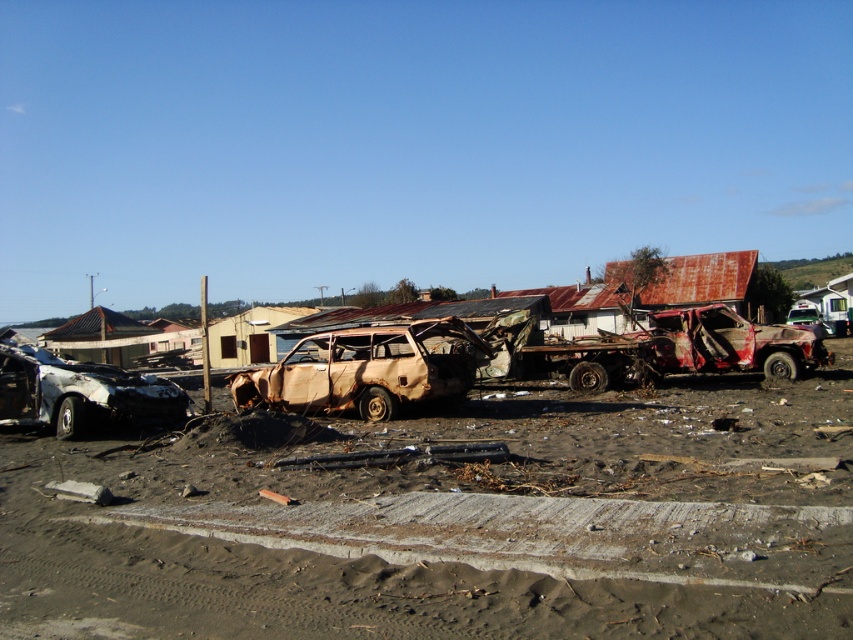
Question: Which point appears farthest from the camera in this image?

Choices:
 (A) (10, 424)
 (B) (737, 364)
 (C) (813, 317)

Answer: (C)

Question: Considering the relative positions of burnt wood car at lower left and rusty metal truck at right in the image provided, where is burnt wood car at lower left located with respect to rusty metal truck at right?

Choices:
 (A) left
 (B) right

Answer: (A)

Question: Can you confirm if burnt wood car at center is positioned to the right of rusty metal truck at center-right?

Choices:
 (A) yes
 (B) no

Answer: (B)

Question: Does burnt wood car at center have a smaller size compared to burnt wood car at lower left?

Choices:
 (A) no
 (B) yes

Answer: (A)

Question: Which of the following is the farthest from the observer?

Choices:
 (A) burnt wood car at center
 (B) rusty metal truck at right
 (C) burnt wood car at lower left
 (D) rusty metal truck at center-right

Answer: (B)

Question: Estimate the real-world distances between objects in this image. Which object is closer to the burnt wood car at center?

Choices:
 (A) rusty metal truck at right
 (B) rusty metal truck at center-right

Answer: (B)